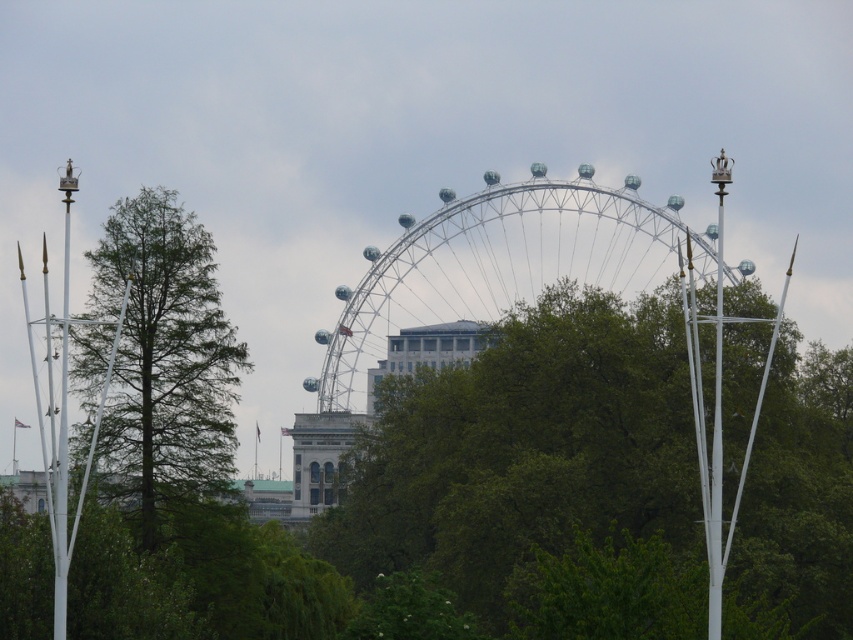
Question: Is green leafy tree at center bigger than green matte tree at left?

Choices:
 (A) no
 (B) yes

Answer: (B)

Question: Is green leafy tree at center positioned at the back of green matte tree at left?

Choices:
 (A) no
 (B) yes

Answer: (A)

Question: Which point appears farthest from the camera in this image?

Choices:
 (A) (192, 243)
 (B) (554, 259)
 (C) (474, 417)

Answer: (B)

Question: Among these objects, which one is farthest from the camera?

Choices:
 (A) metallic silver ferris wheel at center
 (B) green leafy tree at center

Answer: (A)

Question: Which of the following is the closest to the observer?

Choices:
 (A) green leafy tree at center
 (B) metallic silver ferris wheel at center

Answer: (A)

Question: Considering the relative positions of green leafy tree at center and metallic silver ferris wheel at center in the image provided, where is green leafy tree at center located with respect to metallic silver ferris wheel at center?

Choices:
 (A) right
 (B) left

Answer: (A)